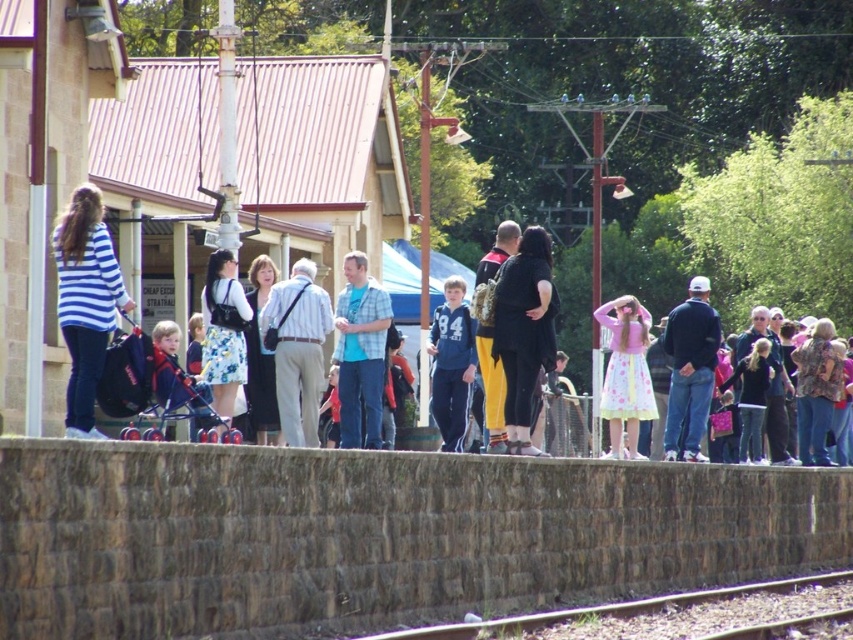
Consider the image. You are a photographer standing on the train station platform. You want to take a photo of both the striped cotton shirt at center and the blue plaid shirt at center in the same frame. Your camera has a maximum focus range that can capture objects up to 60 centimeters apart. Will both shirts fit within the camera frame?

The distance between the striped cotton shirt at center and the blue plaid shirt at center is 59.34 centimeters, which is under the camera maximum focus range of 60 centimeters. Therefore, both shirts can be captured in the same frame.

You are a photographer standing on the platform and want to capture a photo of the blue plaid shirt at center without the smooth metal train track at lower center appearing in the foreground. Is this possible?

The smooth metal train track at lower center is behind the blue plaid shirt at center, so you can take the photo without the track appearing in the foreground.